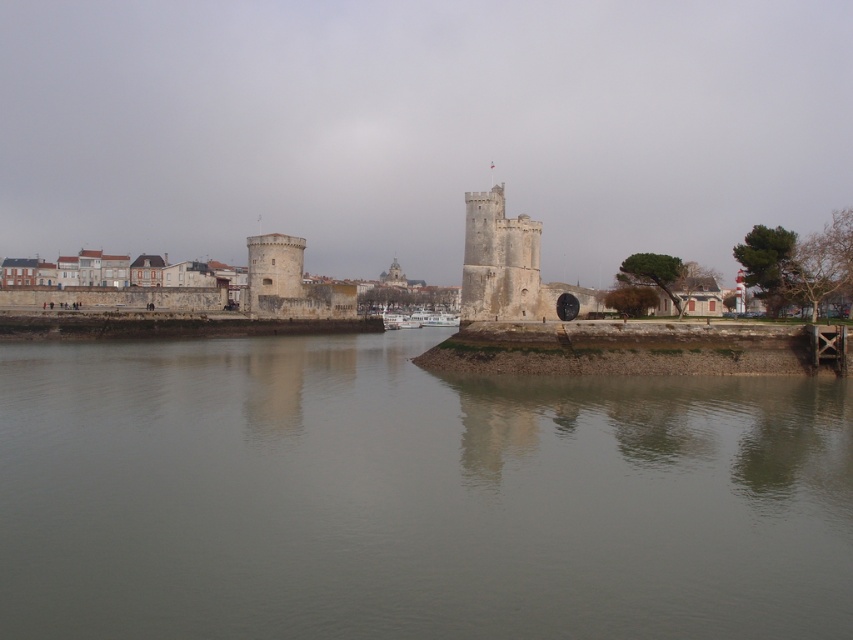
Is gray concrete river at center bigger than stone tower at center?

Indeed, gray concrete river at center has a larger size compared to stone tower at center.

Between point (219, 502) and point (502, 307), which one is positioned behind?

Point (502, 307)

I want to click on gray concrete river at center, so click(410, 497).